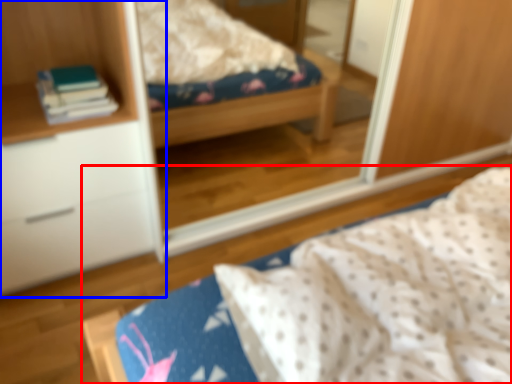
Question: Which object is closer to the camera taking this photo, bed (highlighted by a red box) or cabinetry (highlighted by a blue box)?

Choices:
 (A) bed
 (B) cabinetry

Answer: (A)